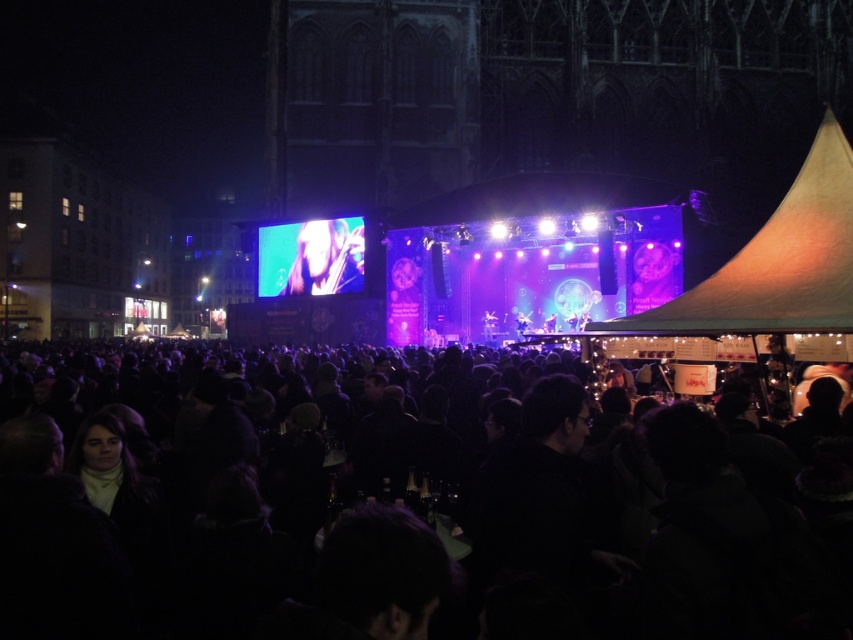
Question: In this image, where is black matte crowd at center located relative to smooth skin face at center?

Choices:
 (A) below
 (B) above

Answer: (A)

Question: Which of the following is the closest to the observer?

Choices:
 (A) black matte crowd at center
 (B) smooth skin face at center

Answer: (A)

Question: Which point is closer to the camera?

Choices:
 (A) (328, 228)
 (B) (265, 524)

Answer: (B)

Question: Among these objects, which one is farthest from the camera?

Choices:
 (A) smooth skin face at center
 (B) black matte crowd at center

Answer: (A)

Question: Is black matte crowd at center behind smooth skin face at center?

Choices:
 (A) yes
 (B) no

Answer: (B)

Question: Does black matte crowd at center lie in front of smooth skin face at center?

Choices:
 (A) no
 (B) yes

Answer: (B)